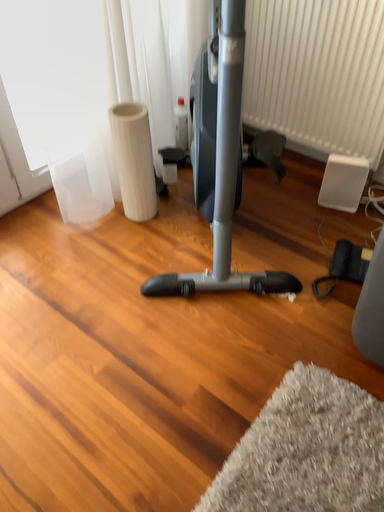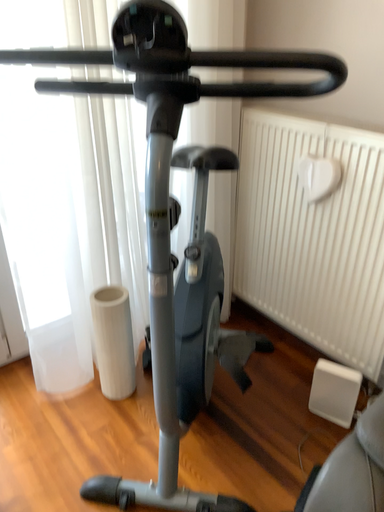
Question: Which way did the camera rotate in the video?

Choices:
 (A) rotated left
 (B) rotated right

Answer: (A)